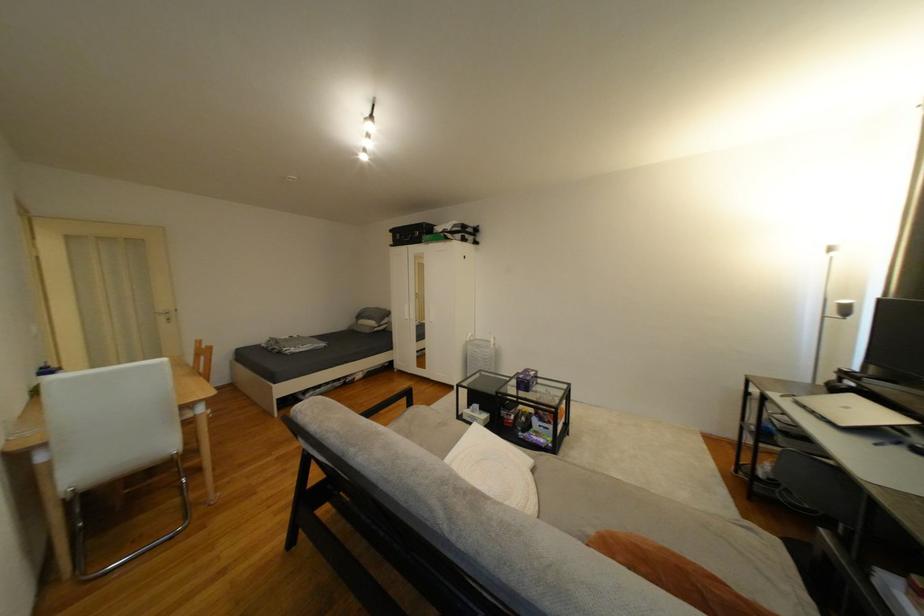
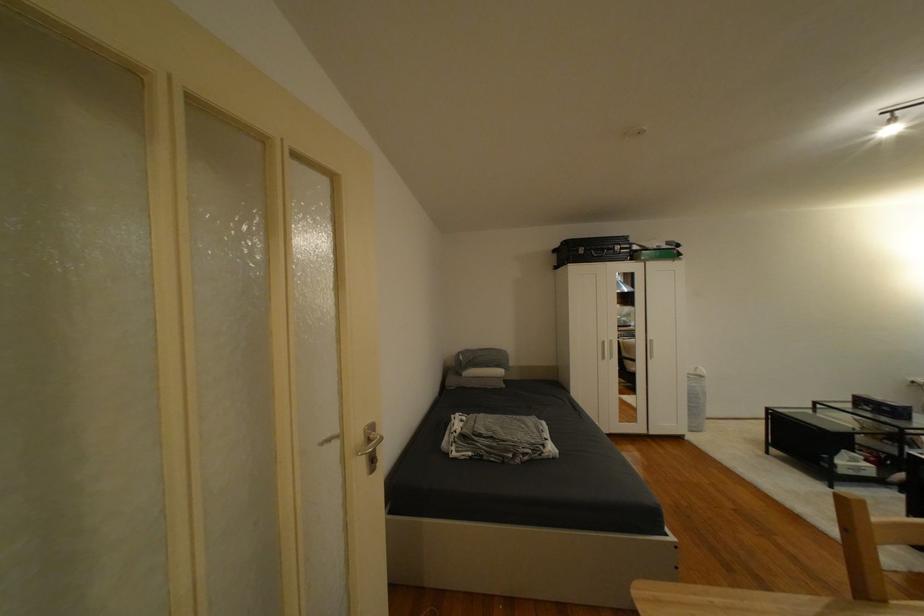
What movement of the cameraman would produce the second image?

The cameraman moved toward left, forward.